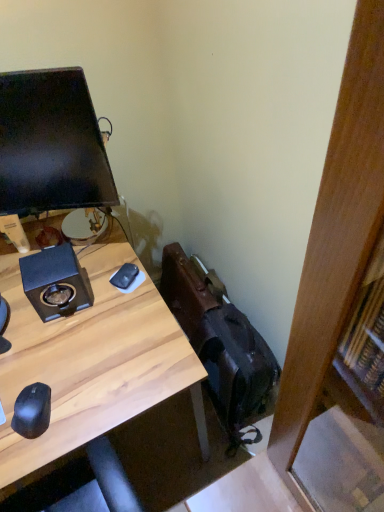
The width and height of the screenshot is (384, 512). Identify the location of vacant position to the left of black matte speaker at upper left. (14, 306).